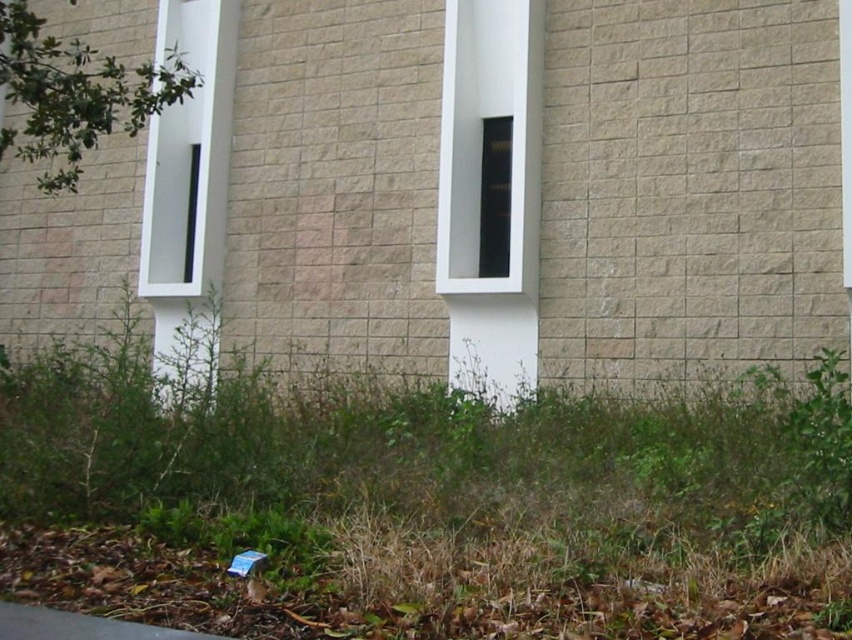
What do you see at coordinates (429, 502) in the screenshot? This screenshot has width=852, height=640. I see `green grass at lower center` at bounding box center [429, 502].

Does green grass at lower center appear on the left side of white glossy window at center?

Yes, green grass at lower center is to the left of white glossy window at center.

Is point (809, 621) less distant than point (504, 1)?

Yes.

Find the location of a particular element. green grass at lower center is located at coordinates (x=429, y=502).

Who is more forward, [533,246] or [188,173]?

Point [533,246] is more forward.

Does point (469, 291) lie in front of point (233, 80)?

Yes.

Identify the location of white glossy window at center. (481, 138).

The width and height of the screenshot is (852, 640). What do you see at coordinates (481, 138) in the screenshot?
I see `white glossy window at center` at bounding box center [481, 138].

Is white glossy window at center further to the viewer compared to green leafy plant at upper left?

Yes.

Does point (531, 49) come farther from viewer compared to point (96, 118)?

That is True.

The image size is (852, 640). Find the location of `white glossy window at center`. white glossy window at center is located at coordinates (481, 138).